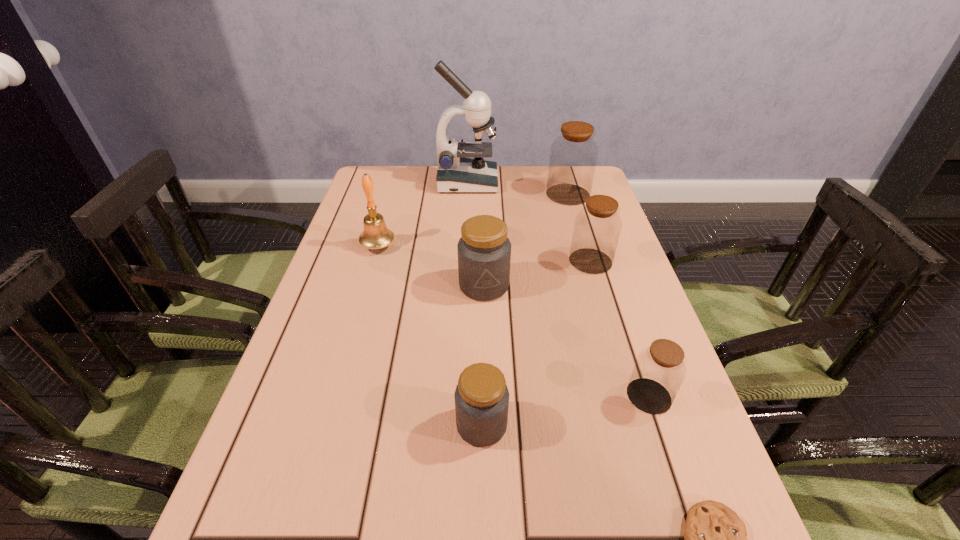
Locate an element on the screen. This screenshot has height=540, width=960. free space that is in between the microscope and the smaller gray jar is located at coordinates (474, 303).

This screenshot has height=540, width=960. Identify the location of object that stands as the sixth closest to the nearer gray jar. (573, 156).

Locate which object is the sixth closest to the second smallest brown jar. Please provide its 2D coordinates. Your answer should be formatted as a tuple, i.e. [(x, y)], where the tuple contains the x and y coordinates of a point satisfying the conditions above.

[(375, 235)]

Identify the location of the fourth closest jar to the bigger gray jar. (573, 156).

You are a GUI agent. You are given a task and a screenshot of the screen. Output one action in this format:
    pyautogui.click(x=<x>, y=<y>)
    Task: Click on the second closest jar relative to the bell
    Image resolution: width=960 pixels, height=540 pixels.
    Given the screenshot: What is the action you would take?
    pyautogui.click(x=597, y=227)

Identify the location of brown jar that can be found as the second closest to the gray microscope. The height and width of the screenshot is (540, 960). (597, 227).

What are the coordinates of `the third closest brown jar to the brown cookie` in the screenshot? It's located at (573, 156).

You are a GUI agent. You are given a task and a screenshot of the screen. Output one action in this format:
    pyautogui.click(x=<x>, y=<y>)
    Task: Click on the free space that satisfies the following two spatial constraints: 1. on the back side of the tallest jar; 2. on the right side of the leftmost object
    
    Given the screenshot: What is the action you would take?
    pyautogui.click(x=393, y=194)

This screenshot has height=540, width=960. I want to click on vacant region that satisfies the following two spatial constraints: 1. on the front side of the nearest brown jar; 2. on the right side of the farthest brown jar, so 627,396.

Where is `blank space that satisfies the following two spatial constraints: 1. on the surface of the farther gray jar near the warning symbol; 2. on the surface of the nearer gray jar near the warning symbol`? This screenshot has width=960, height=540. blank space that satisfies the following two spatial constraints: 1. on the surface of the farther gray jar near the warning symbol; 2. on the surface of the nearer gray jar near the warning symbol is located at coordinates [486, 424].